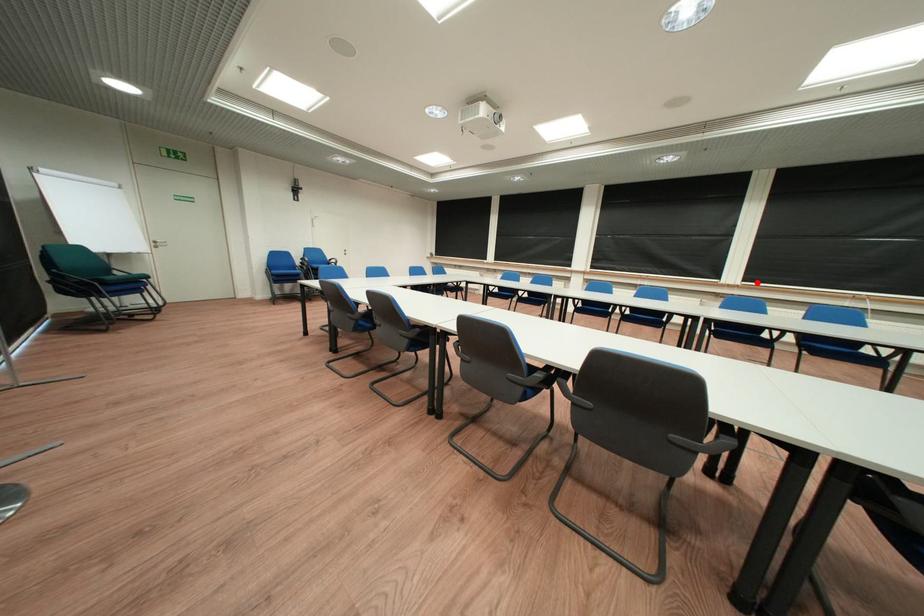
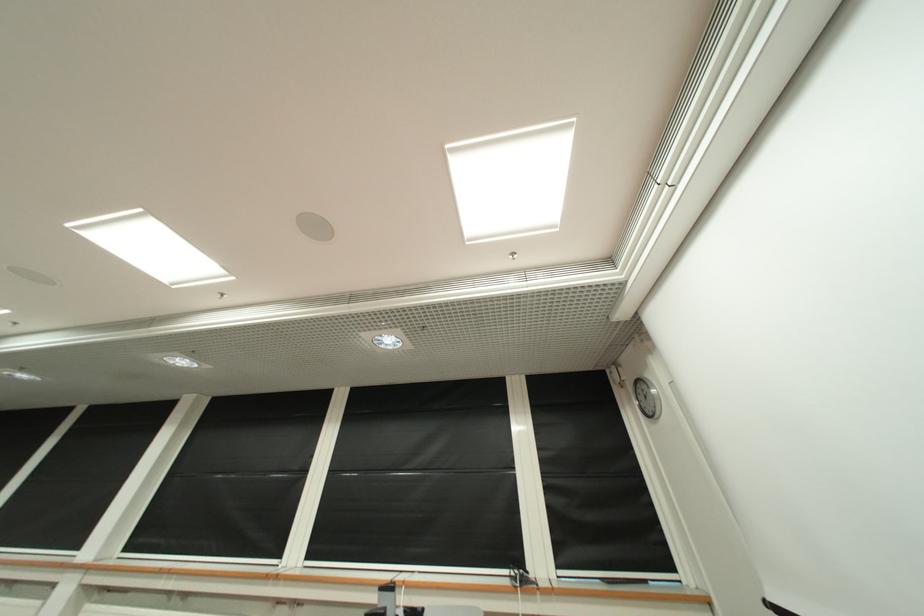
Find the pixel in the second image that matches the highlighted location in the first image.

(321, 560)